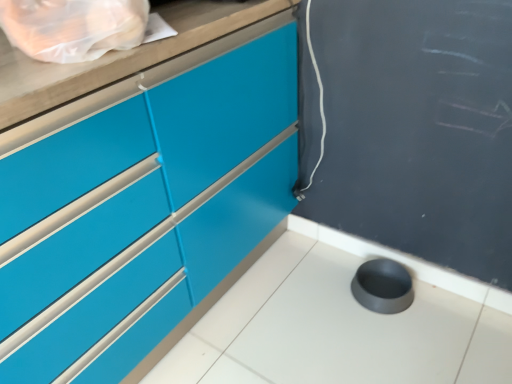
Where is `translucent plastic bag at upper left`? translucent plastic bag at upper left is located at coordinates (73, 27).

Measure the distance between point (132,17) and camera.

Point (132,17) is 32.64 inches away from camera.

This screenshot has width=512, height=384. Describe the element at coordinates (73, 27) in the screenshot. I see `translucent plastic bag at upper left` at that location.

Find the location of a particular element. Image resolution: width=512 pixels, height=384 pixels. translucent plastic bag at upper left is located at coordinates (73, 27).